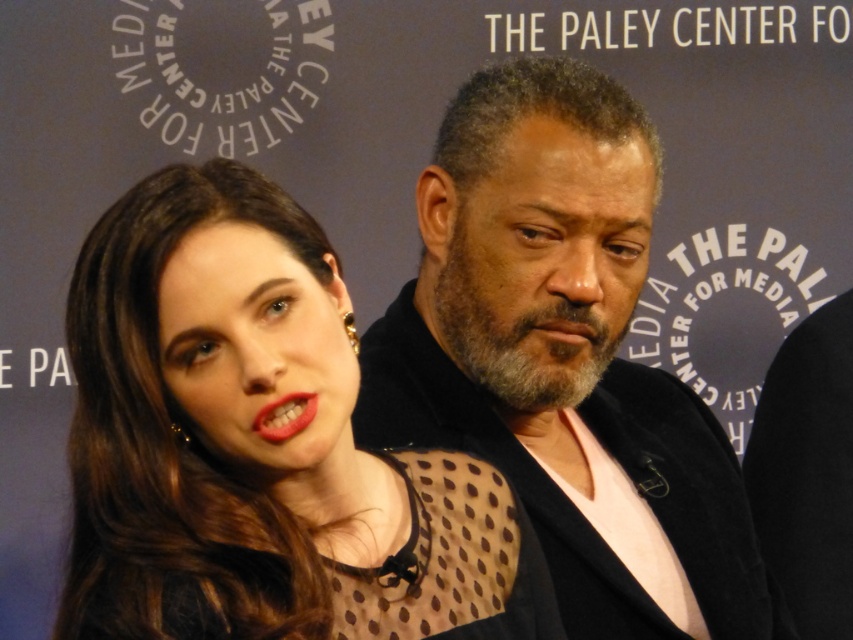
You are a fashion stylist preparing a photoshoot for a client. You have two items in front of you, the matte black dress at center and the dark brown textured jacket at center. Based on their sizes, which item would you recommend placing in the foreground to ensure it doesn not get lost in the composition?

The matte black dress at center occupies less space than the dark brown textured jacket at center, so placing the matte black dress at center in the foreground would help it stand out and prevent it from being overshadowed by the larger jacket.